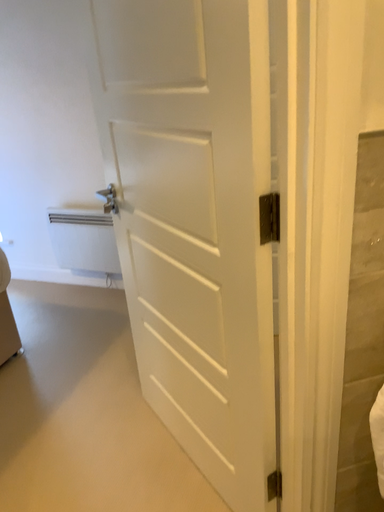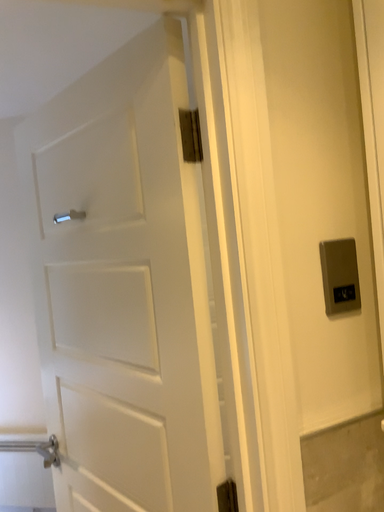
Question: Which way did the camera rotate in the video?

Choices:
 (A) rotated downward
 (B) rotated upward

Answer: (B)